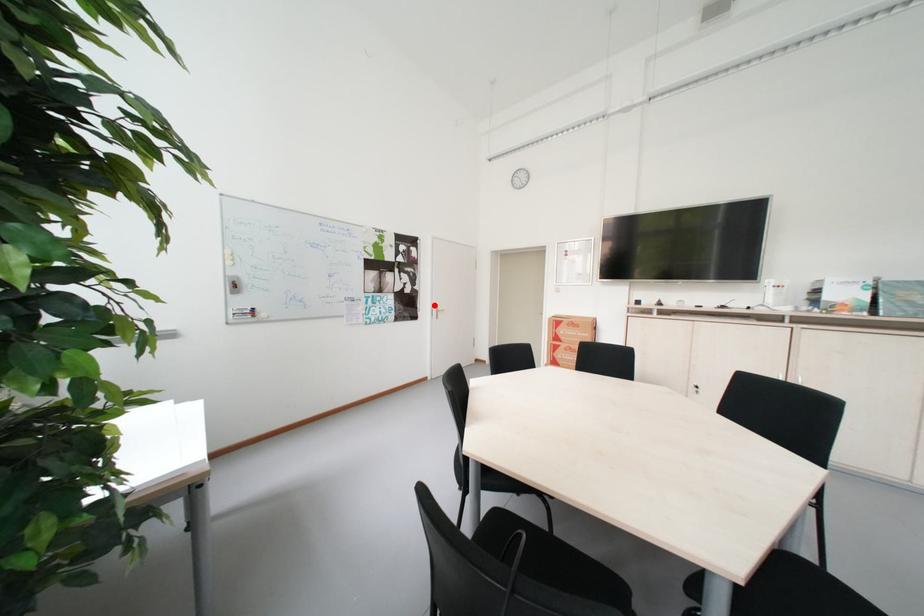
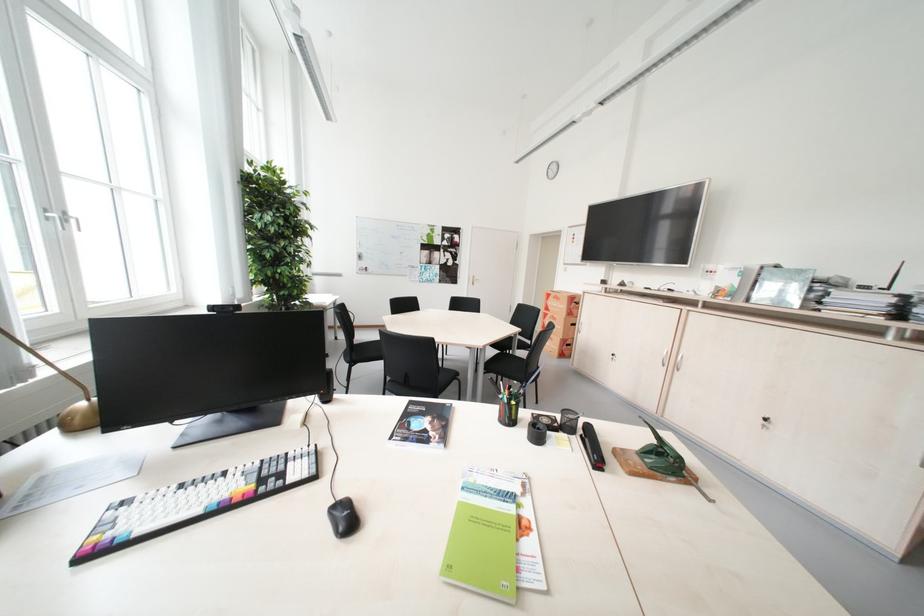
In the second image, find the point that corresponds to the highlighted location in the first image.

(473, 275)